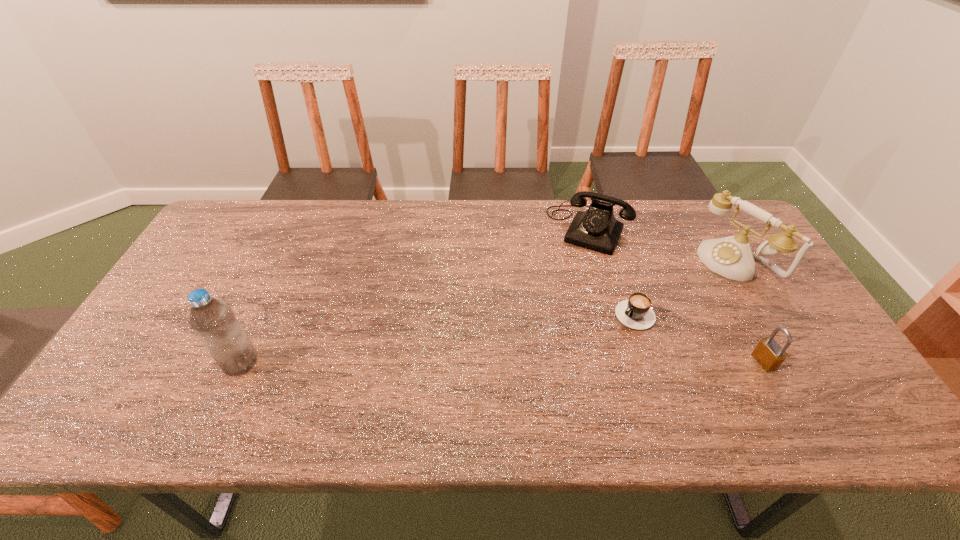
Identify the location of the leftmost object. (213, 320).

Image resolution: width=960 pixels, height=540 pixels. I want to click on water bottle, so click(x=213, y=320).

Locate an element on the screen. This screenshot has height=540, width=960. padlock is located at coordinates (768, 352).

The height and width of the screenshot is (540, 960). In order to click on the second tallest object in this screenshot , I will do `click(731, 257)`.

Where is `the taller telephone`? This screenshot has height=540, width=960. the taller telephone is located at coordinates (731, 257).

This screenshot has width=960, height=540. In order to click on the left telephone in this screenshot , I will do `click(596, 229)`.

Where is `the third farthest object`? The width and height of the screenshot is (960, 540). the third farthest object is located at coordinates (636, 313).

The width and height of the screenshot is (960, 540). What are the coordinates of `cappuccino` in the screenshot? It's located at (636, 313).

What are the coordinates of `free location located 0.390m on the back of the water bottle` in the screenshot? It's located at (293, 246).

At what (x,y) coordinates should I click in order to perform the action: click on vacant space located on the left of the padlock. Please return your answer as a coordinate pair (x, y). This screenshot has height=540, width=960. Looking at the image, I should click on (599, 361).